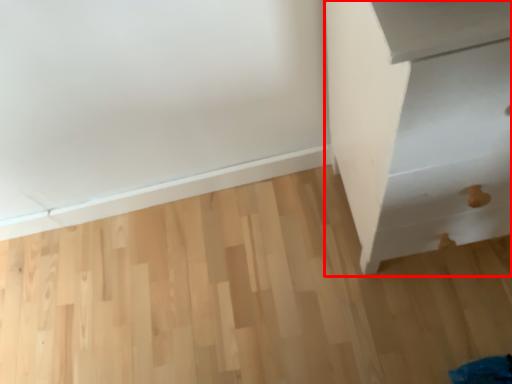
Question: From the image's perspective, what is the correct spatial relationship of furniture (annotated by the red box) in relation to plywood?

Choices:
 (A) above
 (B) below

Answer: (A)